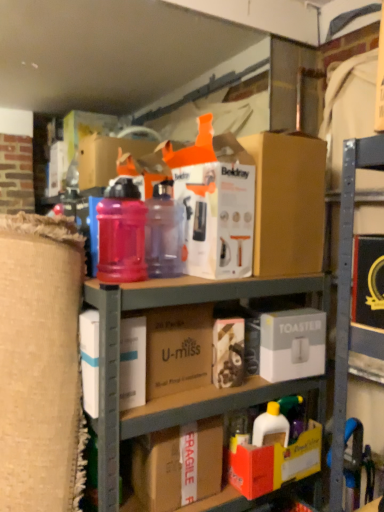
Question: Does red cardboard box at lower center, acting as the first box starting from the bottom, have a larger size compared to translucent plastic water bottle at center, which is counted as the second bottle, starting from the right?

Choices:
 (A) no
 (B) yes

Answer: (B)

Question: Can you confirm if red cardboard box at lower center, acting as the first box starting from the bottom, is smaller than translucent plastic water bottle at center, which is counted as the second bottle, starting from the right?

Choices:
 (A) no
 (B) yes

Answer: (A)

Question: Is red cardboard box at lower center, the fourth box viewed from the top, facing away from translucent plastic water bottle at center, which is counted as the second bottle, starting from the right?

Choices:
 (A) yes
 (B) no

Answer: (B)

Question: Does red cardboard box at lower center, acting as the first box starting from the bottom, have a greater height compared to translucent plastic water bottle at center, which is counted as the second bottle, starting from the right?

Choices:
 (A) no
 (B) yes

Answer: (A)

Question: Is red cardboard box at lower center, the fourth box viewed from the top, shorter than translucent plastic water bottle at center, the first bottle when ordered from left to right?

Choices:
 (A) no
 (B) yes

Answer: (B)

Question: Could translucent plastic water bottle at center, the first bottle when ordered from left to right, be considered to be inside red cardboard box at lower center, the fourth box viewed from the top?

Choices:
 (A) no
 (B) yes

Answer: (A)

Question: Is brown cardboard at center, which is the first cardboard box in top-to-bottom order, not inside translucent plastic water bottle at center, the first bottle when ordered from left to right?

Choices:
 (A) no
 (B) yes

Answer: (B)

Question: Does brown cardboard at center, the 2th cardboard box positioned from the bottom, have a lesser width compared to translucent plastic water bottle at center, the first bottle when ordered from left to right?

Choices:
 (A) no
 (B) yes

Answer: (A)

Question: Is brown cardboard at center, the 2th cardboard box positioned from the bottom, not near translucent plastic water bottle at center, which is counted as the second bottle, starting from the right?

Choices:
 (A) yes
 (B) no

Answer: (B)

Question: Could you tell me if brown cardboard at center, which is the first cardboard box in top-to-bottom order, is facing translucent plastic water bottle at center, the first bottle when ordered from left to right?

Choices:
 (A) yes
 (B) no

Answer: (B)

Question: Is brown cardboard at center, the 2th cardboard box positioned from the bottom, at the right side of translucent plastic water bottle at center, which is counted as the second bottle, starting from the right?

Choices:
 (A) no
 (B) yes

Answer: (B)

Question: Can you confirm if brown cardboard at center, which is the first cardboard box in top-to-bottom order, is shorter than translucent plastic water bottle at center, the first bottle when ordered from left to right?

Choices:
 (A) no
 (B) yes

Answer: (B)

Question: Is cardboard boxes at center aimed at brown cardboard box at upper center, acting as the fourth box starting from the bottom?

Choices:
 (A) no
 (B) yes

Answer: (A)